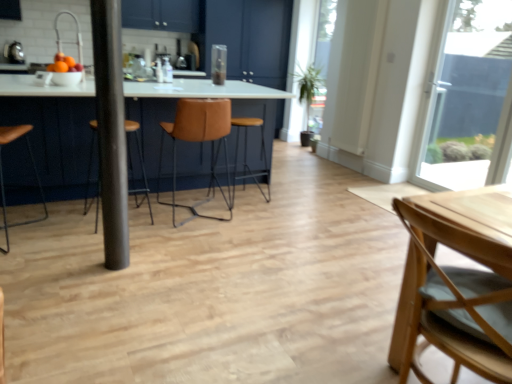
I want to click on free area in between brown leather stool at left, the 4th chair positioned from the right, and metallic pole at center, so click(x=65, y=246).